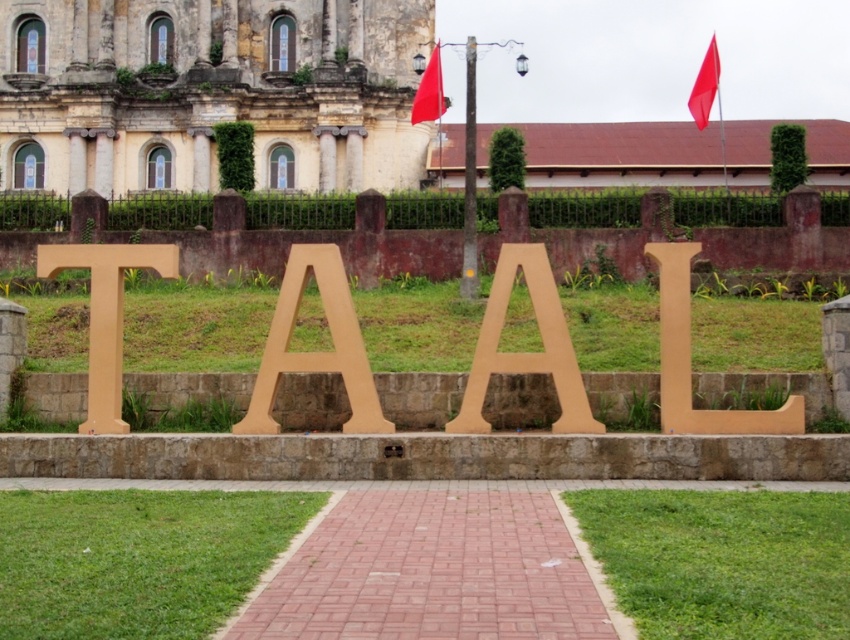
Looking at this image, you are standing on the pathway and looking at the sign. Which letter is higher up, the matte gold letter t at left or the matte wood letter l at center?

The matte gold letter t at left is higher up than the matte wood letter l at center because it is positioned above it.

You are standing at the entrance of the historic building and want to walk directly to the matte gold letter a at center. Which direction should you head towards?

Since the matte gold letter a at center is located at point (315, 352), you should head towards the center area in front of the historic building to reach it.

You are standing at the entrance of the historic building and want to walk towards the sign that says TAAL. The path you need to take is the red brick path at center. However, there is a matte wood letter l at center in your way. Based on their positions, which object should you step over or under to continue towards the sign?

The red brick path at center is below the matte wood letter l at center, so you should step over the matte wood letter l at center to continue towards the sign.